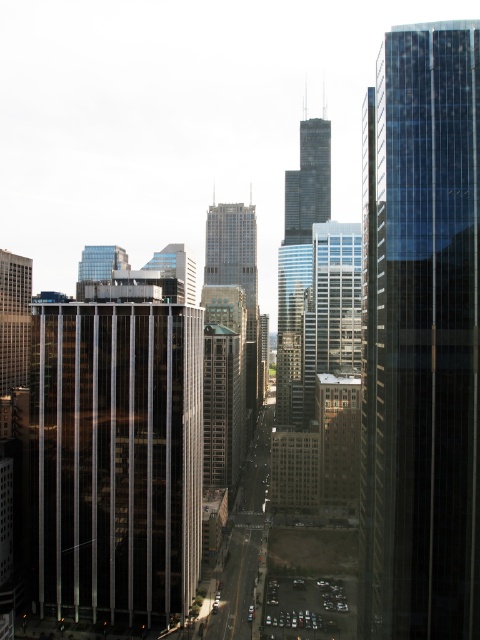
You are a city planner designing a new pedestrian walkway between the clear glass skyscraper at center and the glassy steel skyscraper at center. The walkway must be at least 90 meters long to accommodate safety standards. Based on the scene description, will the proposed walkway meet the required length?

The distance between the clear glass skyscraper at center and the glassy steel skyscraper at center is 89.26 meters, which is slightly shorter than the required 90 meters. Therefore, the proposed walkway will not meet the required length.

In the scene shown: You are a city planner analyzing the urban layout. Based on the scene, which of the two buildings, the shiny glass skyscraper at center or the matte glass building at center, is shorter?

The shiny glass skyscraper at center is shorter than the matte glass building at center according to the description.

You are standing at the intersection near the parked cars on the street. Which direction should you look to see the clear glass skyscraper at center?

The clear glass skyscraper at center is located at point coordinates, so you should look towards the center of the image where it is situated.